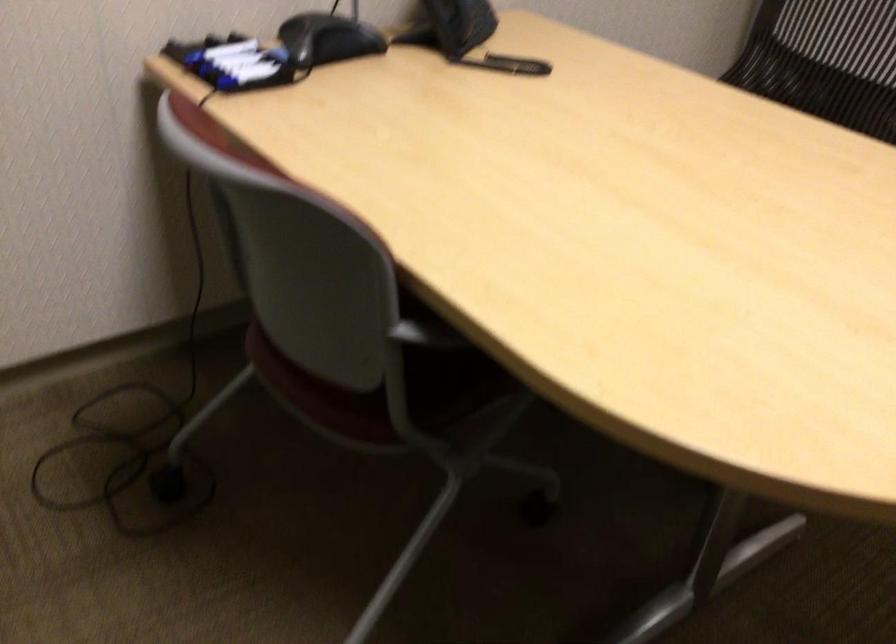
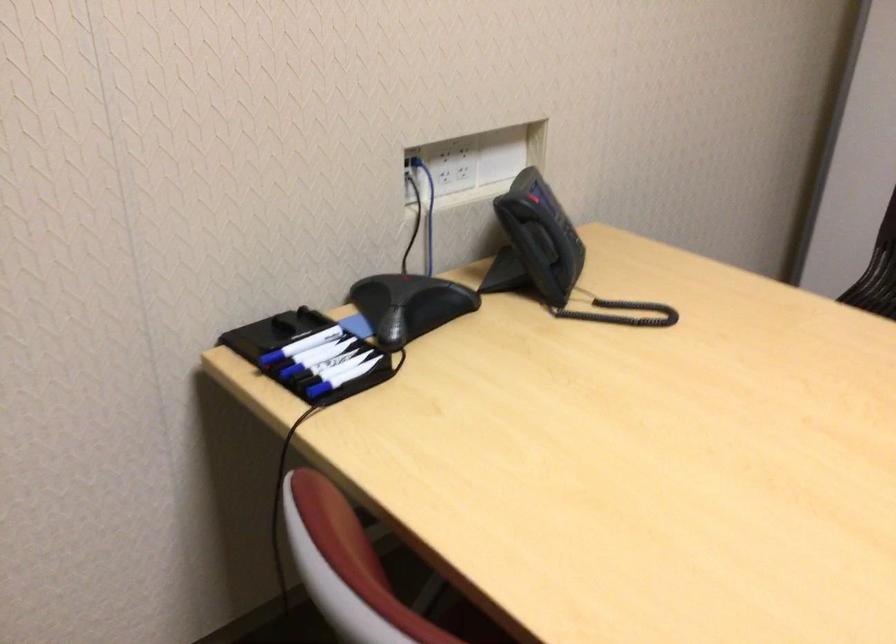
The point at (222, 75) is marked in the first image. Where is the corresponding point in the second image?

(307, 379)